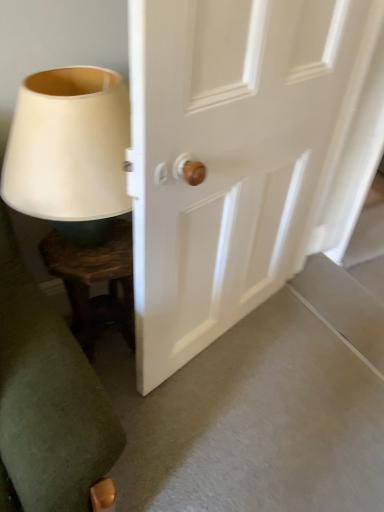
Question: Would you say dark wood side table at lower left is a long distance from matte white lampshade at left?

Choices:
 (A) no
 (B) yes

Answer: (A)

Question: Could you tell me if dark wood side table at lower left is facing matte white lampshade at left?

Choices:
 (A) no
 (B) yes

Answer: (A)

Question: From a real-world perspective, is dark wood side table at lower left located higher than matte white lampshade at left?

Choices:
 (A) no
 (B) yes

Answer: (A)

Question: Considering the relative sizes of dark wood side table at lower left and matte white lampshade at left in the image provided, is dark wood side table at lower left taller than matte white lampshade at left?

Choices:
 (A) yes
 (B) no

Answer: (A)

Question: Does dark wood side table at lower left have a lesser width compared to matte white lampshade at left?

Choices:
 (A) yes
 (B) no

Answer: (A)

Question: Is white wooden door at center inside the boundaries of dark wood side table at lower left, or outside?

Choices:
 (A) inside
 (B) outside

Answer: (B)

Question: From a real-world perspective, is white wooden door at center physically located above or below dark wood side table at lower left?

Choices:
 (A) below
 (B) above

Answer: (B)

Question: Is white wooden door at center wider or thinner than dark wood side table at lower left?

Choices:
 (A) wide
 (B) thin

Answer: (B)

Question: Considering their positions, is white wooden door at center located in front of or behind dark wood side table at lower left?

Choices:
 (A) front
 (B) behind

Answer: (A)

Question: In the image, is dark wood side table at lower left positioned in front of or behind matte white lampshade at left?

Choices:
 (A) front
 (B) behind

Answer: (B)

Question: Is point (48, 261) closer or farther from the camera than point (124, 109)?

Choices:
 (A) closer
 (B) farther

Answer: (B)

Question: From a real-world perspective, relative to matte white lampshade at left, is dark wood side table at lower left vertically above or below?

Choices:
 (A) below
 (B) above

Answer: (A)

Question: Is dark wood side table at lower left wider or thinner than matte white lampshade at left?

Choices:
 (A) wide
 (B) thin

Answer: (B)

Question: Considering the positions of white wooden door at center and matte white lampshade at left in the image, is white wooden door at center taller or shorter than matte white lampshade at left?

Choices:
 (A) short
 (B) tall

Answer: (B)

Question: From the image's perspective, is white wooden door at center located above or below matte white lampshade at left?

Choices:
 (A) below
 (B) above

Answer: (A)